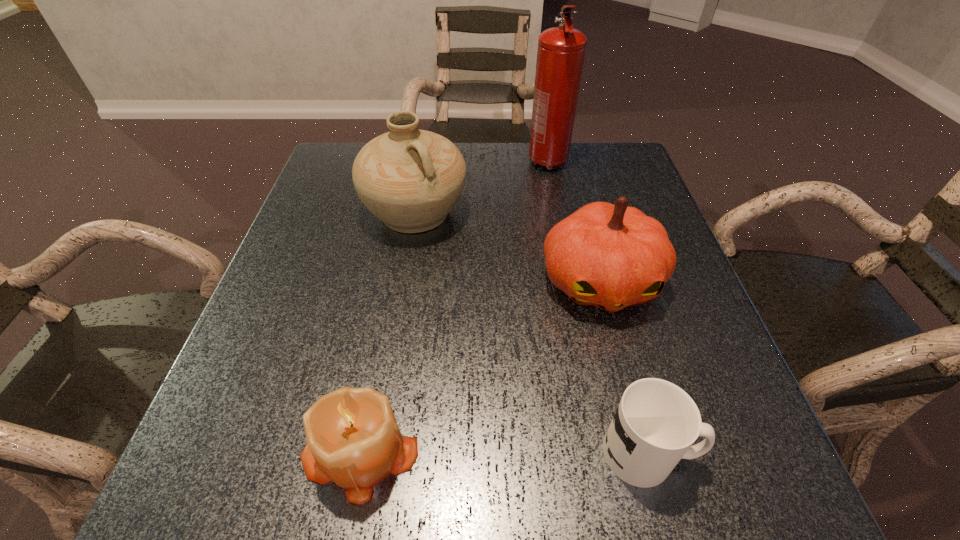
What are the coordinates of `free space between the second shortest object and the mug` in the screenshot? It's located at (505, 451).

Find the location of a particular element. empty location between the third tallest object and the mug is located at coordinates (625, 367).

Where is `unoccupied area between the pottery and the third tallest object`? This screenshot has height=540, width=960. unoccupied area between the pottery and the third tallest object is located at coordinates (508, 247).

Where is `vacant space in between the fourth tallest object and the fire extinguisher`? Image resolution: width=960 pixels, height=540 pixels. vacant space in between the fourth tallest object and the fire extinguisher is located at coordinates (454, 306).

Image resolution: width=960 pixels, height=540 pixels. Identify the location of empty space that is in between the fire extinguisher and the second shortest object. (454, 306).

Select which object appears as the second closest to the candle. Please provide its 2D coordinates. Your answer should be formatted as a tuple, i.e. [(x, y)], where the tuple contains the x and y coordinates of a point satisfying the conditions above.

[(656, 422)]

Identify which object is located as the fourth nearest to the shortest object. Please provide its 2D coordinates. Your answer should be formatted as a tuple, i.e. [(x, y)], where the tuple contains the x and y coordinates of a point satisfying the conditions above.

[(561, 50)]